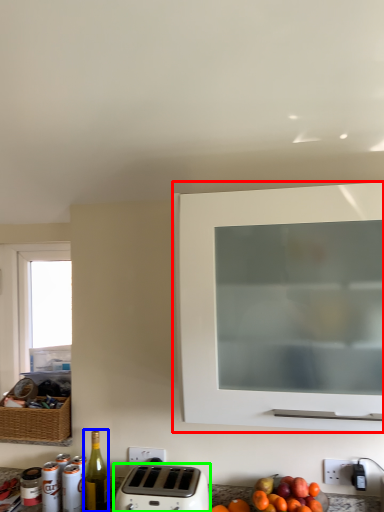
Question: Estimate the real-world distances between objects in this image. Which object is farther from cabinetry (highlighted by a red box), bottle (highlighted by a blue box) or toaster (highlighted by a green box)?

Choices:
 (A) bottle
 (B) toaster

Answer: (A)